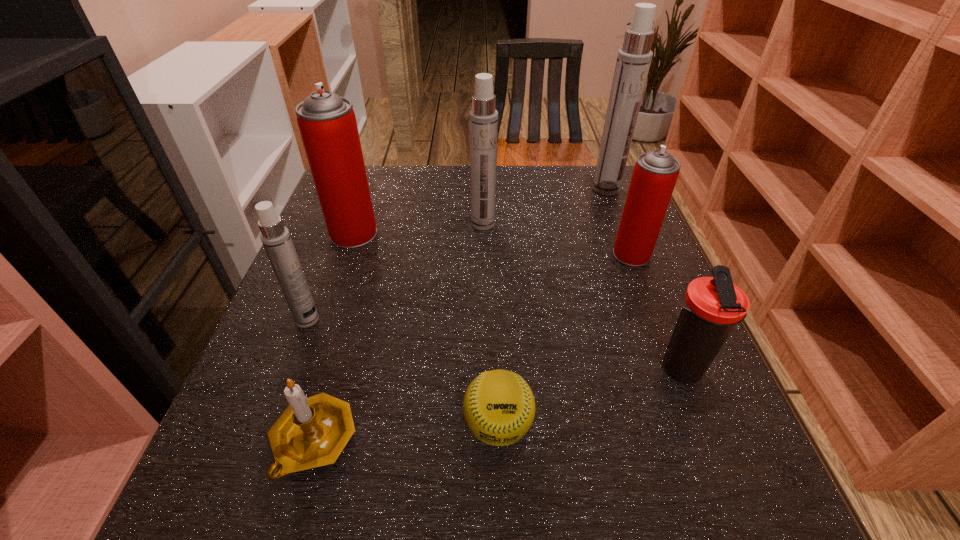
Where is `gold candle holder`? gold candle holder is located at coordinates pyautogui.click(x=312, y=432).

This screenshot has width=960, height=540. Identify the location of candle holder. (312, 432).

The image size is (960, 540). Identify the location of softball. (499, 407).

This screenshot has height=540, width=960. I want to click on yellow softball, so click(x=499, y=407).

You are a GUI agent. You are given a task and a screenshot of the screen. Output one action in this format:
    pyautogui.click(x=<x>, y=<y>)
    Task: Click on the blank area located 0.070m on the front of the tallest aerosol can
    Image resolution: width=960 pixels, height=540 pixels.
    Given the screenshot: What is the action you would take?
    pyautogui.click(x=614, y=211)

Identify the location of vacant space located 0.310m on the front of the third aerosol can from left to right. This screenshot has width=960, height=540. (484, 327).

At what (x,y) coordinates should I click in order to perform the action: click on free space located on the back of the left red aerosol can. Please return your answer as a coordinate pair (x, y). Looking at the image, I should click on (370, 188).

Identify the location of free space located on the front of the smaller red aerosol can. (697, 423).

You are a GUI agent. You are given a task and a screenshot of the screen. Output one action in this format:
    pyautogui.click(x=<x>, y=<y>)
    Task: Click on the vacant space located on the right of the fourth nearest object
    This screenshot has height=540, width=960.
    Given the screenshot: What is the action you would take?
    pyautogui.click(x=480, y=320)

In order to click on blank area located on the front of the third nearest object in this screenshot , I will do `click(738, 519)`.